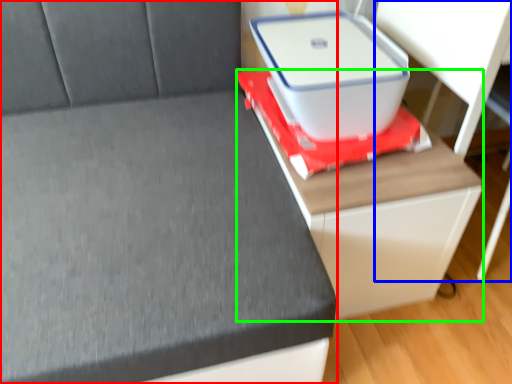
Question: Considering the real-world distances, which object is closest to furniture (highlighted by a red box)? computer desk (highlighted by a blue box) or table (highlighted by a green box).

Choices:
 (A) computer desk
 (B) table

Answer: (B)